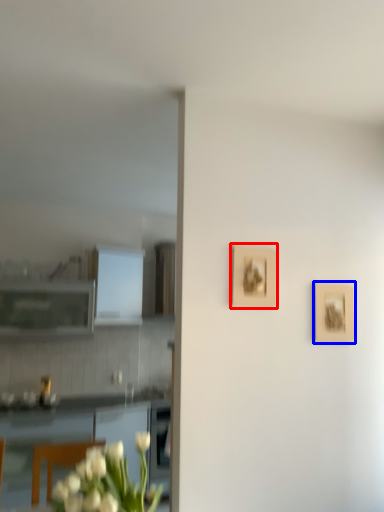
Question: Which object is further to the camera taking this photo, picture frame (highlighted by a red box) or picture frame (highlighted by a blue box)?

Choices:
 (A) picture frame
 (B) picture frame

Answer: (B)